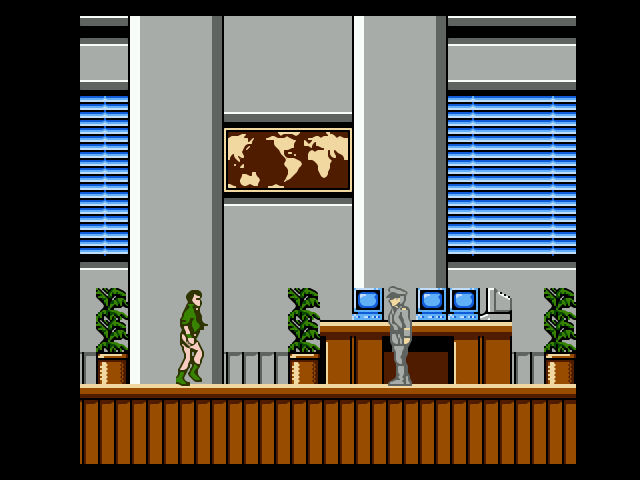
I want to click on desk, so click(x=372, y=329).